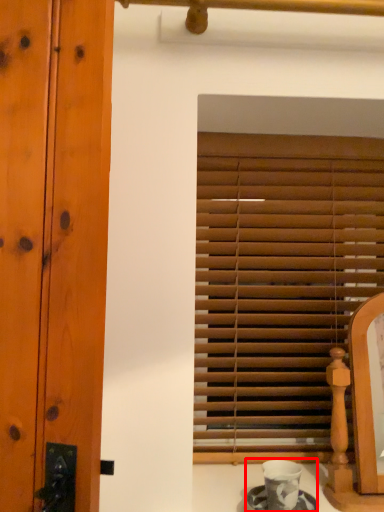
Question: From the image's perspective, where is tea set (annotated by the red box) located relative to window blind?

Choices:
 (A) above
 (B) below

Answer: (B)